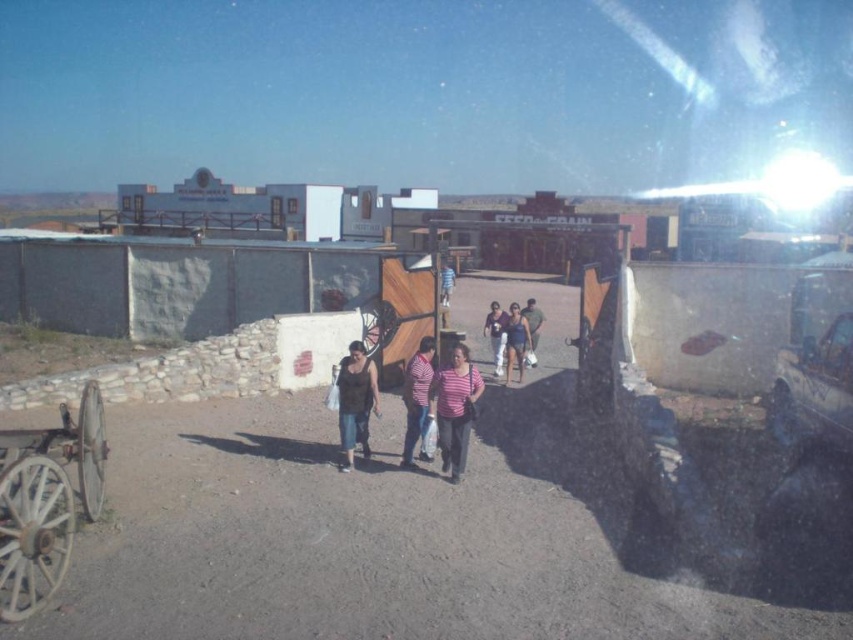
You are standing at the entrance of the Western themed park and see the point marked at coordinates (x=515, y=342). What object is located at that point?

The point at coordinates (x=515, y=342) corresponds to the matte blue tank top at center.

From the picture: You are standing at the point with coordinates point (x=496, y=340) and want to move to the point (x=525, y=340). Is the destination point closer to you or farther away?

The destination point (x=525, y=340) is closer to the viewer than the starting point (x=496, y=340), so moving towards it would mean moving closer.